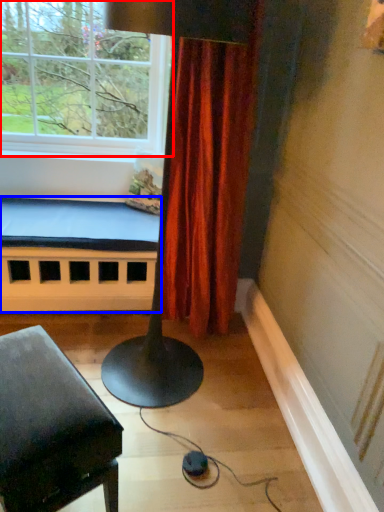
Question: Which point is closer to the camera, window (highlighted by a red box) or bed frame (highlighted by a blue box)?

Choices:
 (A) window
 (B) bed frame

Answer: (A)